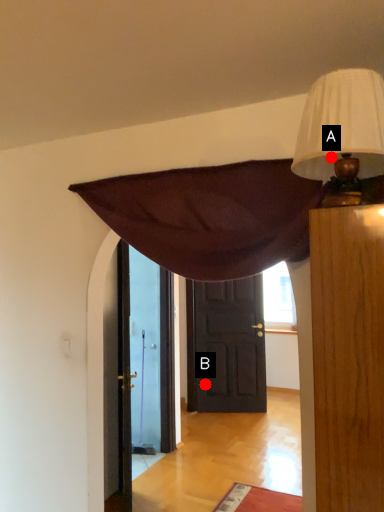
Question: Two points are circled on the image, labeled by A and B beside each circle. Which point is closer to the camera?

Choices:
 (A) A is closer
 (B) B is closer

Answer: (A)